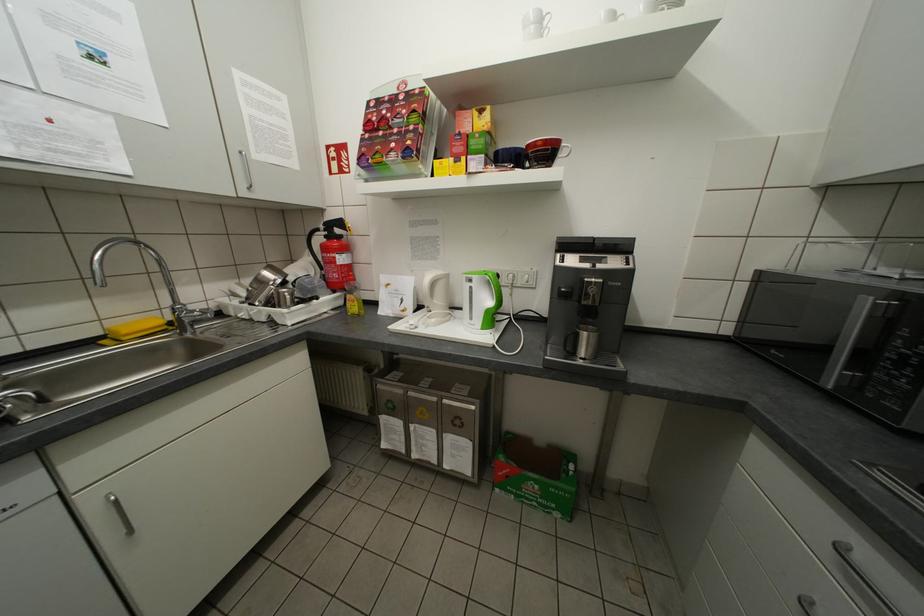
The image size is (924, 616). What do you see at coordinates (246, 169) in the screenshot? I see `the upper cabinet handle` at bounding box center [246, 169].